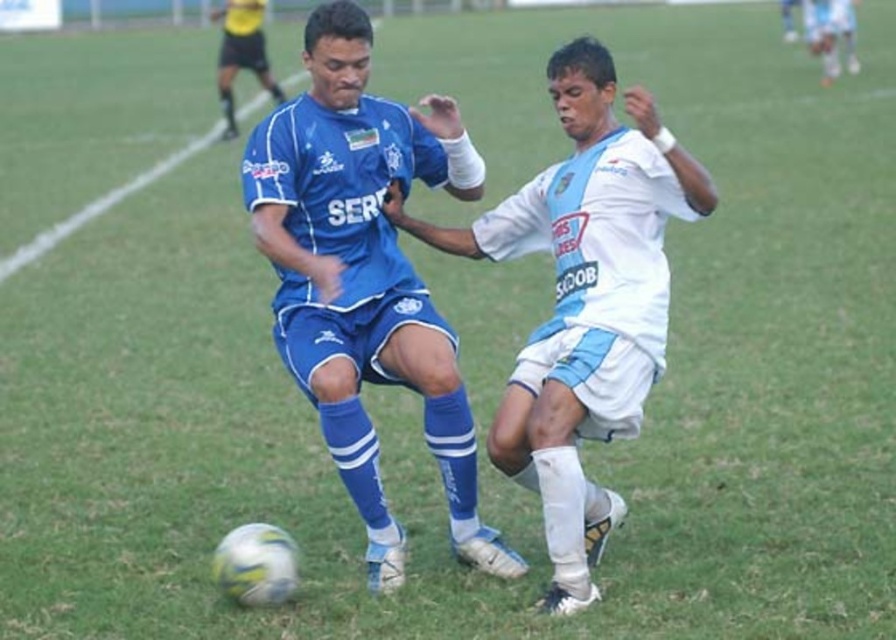
Question: Is matte blue jersey at center in front of white matte soccer player at center?

Choices:
 (A) yes
 (B) no

Answer: (B)

Question: Which of the following is the farthest from the observer?

Choices:
 (A) (364, 58)
 (B) (631, 148)

Answer: (A)

Question: Is matte blue jersey at center thinner than white matte soccer player at center?

Choices:
 (A) yes
 (B) no

Answer: (A)

Question: Does matte blue jersey at center appear over white matte soccer player at center?

Choices:
 (A) no
 (B) yes

Answer: (B)

Question: Which object is closer to the camera taking this photo?

Choices:
 (A) matte blue jersey at center
 (B) white matte soccer player at center

Answer: (B)